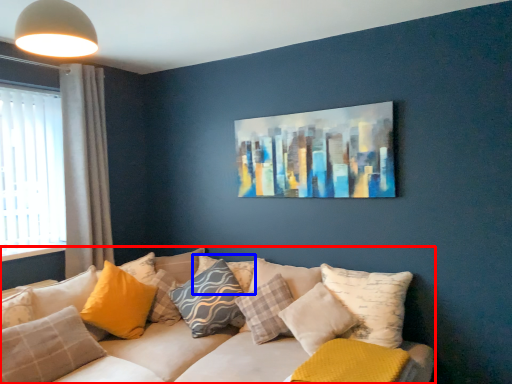
Question: Which point is closer to the camera, studio couch (highlighted by a red box) or pillow (highlighted by a blue box)?

Choices:
 (A) studio couch
 (B) pillow

Answer: (A)